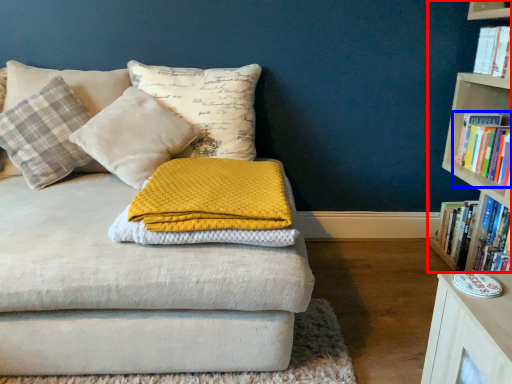
Question: Which object appears farthest to the camera in this image, bookcase (highlighted by a red box) or book (highlighted by a blue box)?

Choices:
 (A) bookcase
 (B) book

Answer: (B)